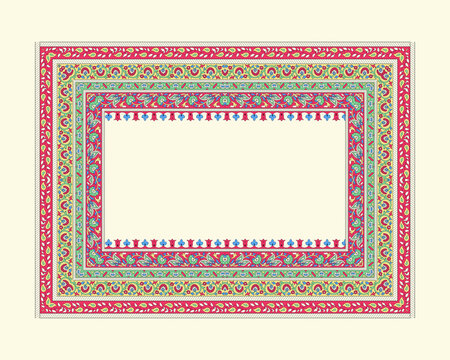
Locate an element on the screen. The image size is (450, 360). middle of rug is located at coordinates (245, 180).